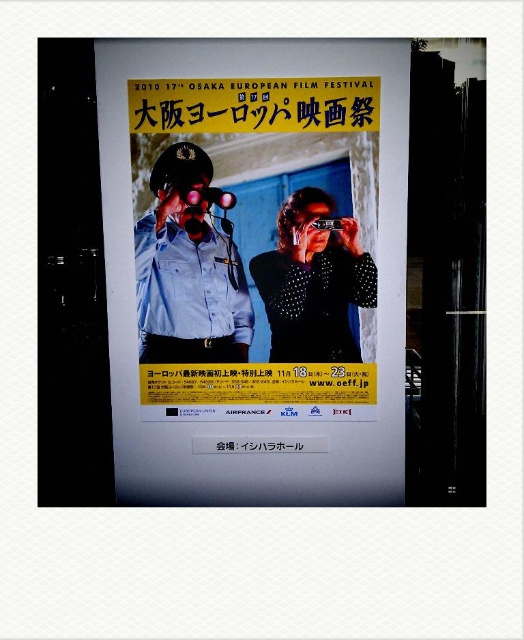
Question: Which object is positioned closest to the matte blue uniform at center?

Choices:
 (A) matte paper poster at center
 (B) matte black goggles at center
 (C) studded leather jacket at center

Answer: (A)

Question: Is matte paper poster at center positioned at the back of matte black goggles at center?

Choices:
 (A) yes
 (B) no

Answer: (B)

Question: Estimate the real-world distances between objects in this image. Which object is closer to the studded leather jacket at center?

Choices:
 (A) matte paper poster at center
 (B) matte blue uniform at center
 (C) matte black goggles at center

Answer: (A)

Question: Which is farther from the studded leather jacket at center?

Choices:
 (A) matte blue uniform at center
 (B) matte black goggles at center
 (C) matte paper poster at center

Answer: (B)

Question: Does studded leather jacket at center appear on the left side of matte black goggles at center?

Choices:
 (A) no
 (B) yes

Answer: (A)

Question: Can you confirm if matte blue uniform at center is bigger than studded leather jacket at center?

Choices:
 (A) yes
 (B) no

Answer: (A)